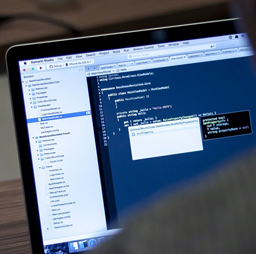
What are the coordinates of `laptop computer` in the screenshot? It's located at (103, 47).